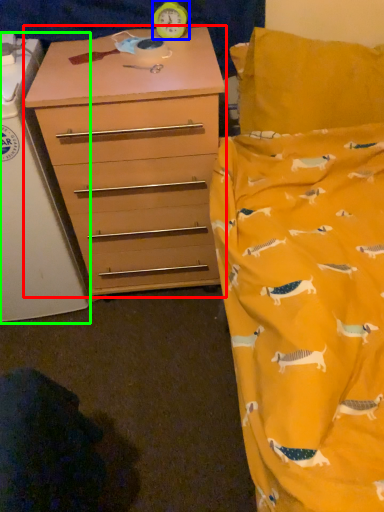
Question: Which is nearer to the chest of drawers (highlighted by a red box)? clock (highlighted by a blue box) or changing table (highlighted by a green box).

Choices:
 (A) clock
 (B) changing table

Answer: (B)